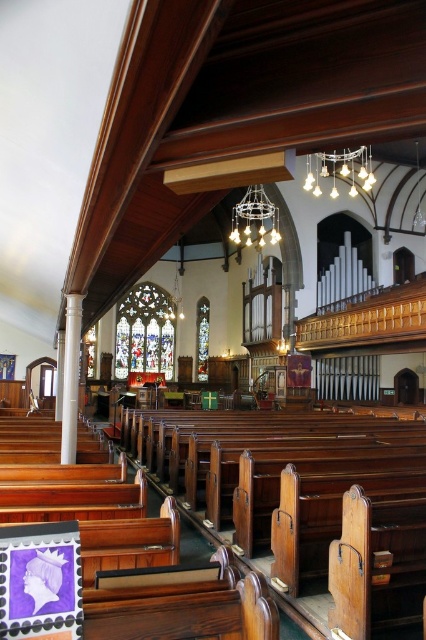
Is point (363, 186) in front of point (232, 225)?

That is True.

You are a GUI agent. You are given a task and a screenshot of the screen. Output one action in this format:
    pyautogui.click(x=<x>, y=<y>)
    Task: Click on the matte glass chandelier at upper center
    
    Given the screenshot: What is the action you would take?
    pyautogui.click(x=339, y=170)